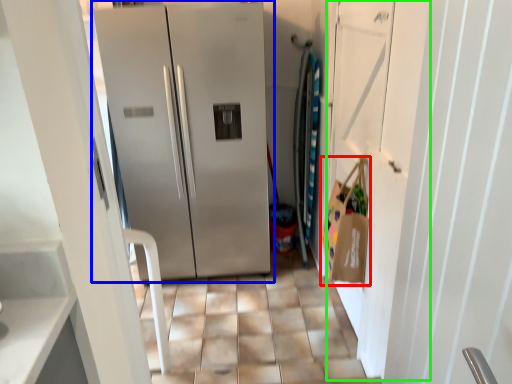
Question: Based on their relative distances, which object is farther from shopping bag (highlighted by a red box)? Choose from refrigerator (highlighted by a blue box) and door (highlighted by a green box).

Choices:
 (A) refrigerator
 (B) door

Answer: (A)